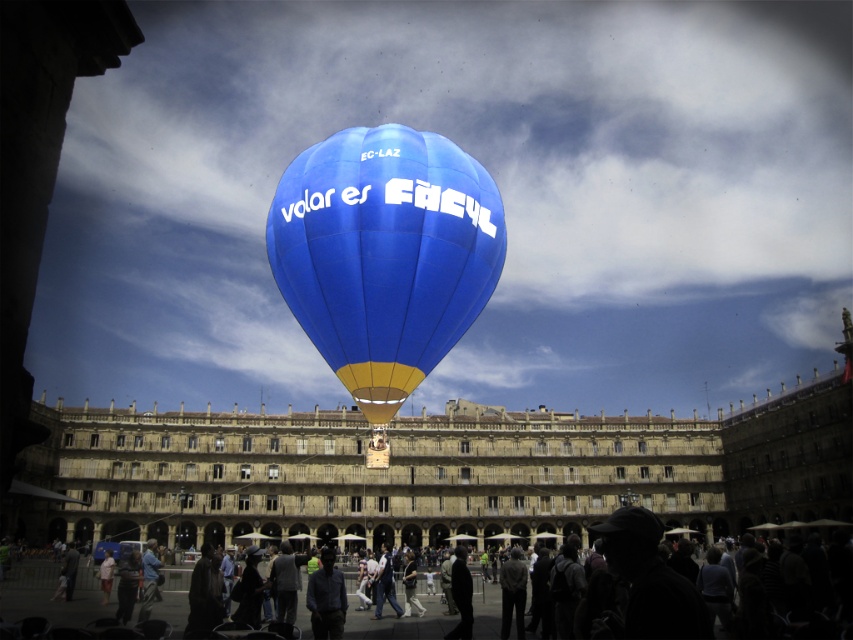
You are a photographer standing in the public square and want to take a photo of the dark gray fabric shirt at center and dark blue jeans at center. Which object is closer to the camera?

The dark gray fabric shirt at center is closer to the camera because it is in front of the dark blue jeans at center.

You are a photographer trying to capture both the silhouette clothing at lower center and the dark gray fabric shirt at center in a single frame. Based on their positions and sizes, which object should you focus on first to ensure both are in the frame?

The silhouette clothing at lower center might be wider than dark gray fabric shirt at center, so focusing on the silhouette clothing at lower center first would help ensure both are included in the frame.